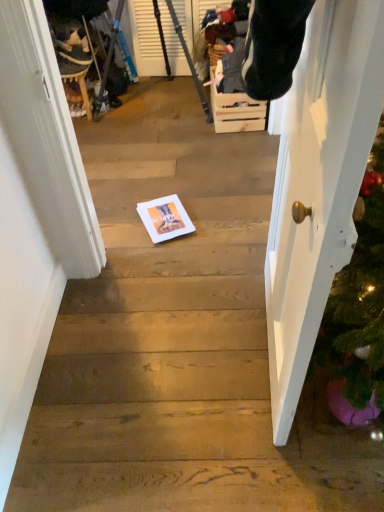
Find the location of a particular element. velvet plush toy at upper left is located at coordinates (72, 53).

This screenshot has width=384, height=512. What do you see at coordinates (189, 61) in the screenshot?
I see `metallic tripod at upper left` at bounding box center [189, 61].

What is the approximate height of white glossy door at right?

Result: white glossy door at right is 3.91 feet tall.

The height and width of the screenshot is (512, 384). What are the coordinates of `white paper at center` in the screenshot? It's located at (165, 218).

Choose the correct answer: Is velvet plush toy at upper left inside white glossy door at right or outside it?

velvet plush toy at upper left is located beyond the bounds of white glossy door at right.

Find the location of `door in front of the velvet plush toy at upper left`. door in front of the velvet plush toy at upper left is located at coordinates (319, 184).

Considering the sizes of velvet plush toy at upper left and white glossy door at right in the image, is velvet plush toy at upper left bigger or smaller than white glossy door at right?

velvet plush toy at upper left is smaller than white glossy door at right.

Does velvet plush toy at upper left have a lesser height compared to white glossy door at right?

Correct, velvet plush toy at upper left is not as tall as white glossy door at right.

Is wooden crate at center located outside metallic tripod at upper left?

Yes, wooden crate at center is located beyond the bounds of metallic tripod at upper left.

In order to click on drawer lying below the metallic tripod at upper left (from the image's perspective) in this screenshot , I will do `click(235, 110)`.

Is wooden crate at center not close to metallic tripod at upper left?

That's not correct — wooden crate at center is a little close to metallic tripod at upper left.

Is point (218, 106) closer to viewer compared to point (204, 104)?

Yes.

Considering the points (194, 230) and (107, 70), which point is in front, point (194, 230) or point (107, 70)?

The point (194, 230) is in front.

Find the location of a particular element. tripod located above the white paper at center (from a real-world perspective) is located at coordinates (189, 61).

Does white paper at center appear on the left side of metallic tripod at upper left?

In fact, white paper at center is to the right of metallic tripod at upper left.

Which is behind, point (176, 23) or point (150, 205)?

The point (176, 23) is behind.

From a real-world perspective, is metallic tripod at upper left under white paper at center?

No, from a real-world perspective, metallic tripod at upper left is not below white paper at center.

Considering the relative sizes of metallic tripod at upper left and white paper at center in the image provided, is metallic tripod at upper left shorter than white paper at center?

Incorrect, the height of metallic tripod at upper left does not fall short of that of white paper at center.

Is metallic tripod at upper left to the right of white paper at center from the viewer's perspective?

Incorrect, metallic tripod at upper left is not on the right side of white paper at center.

Based on the photo, from the image's perspective, is white paper at center under wooden crate at center?

Yes, from the image's perspective, white paper at center is below wooden crate at center.

Considering the positions of objects white paper at center and wooden crate at center in the image provided, who is more to the right, white paper at center or wooden crate at center?

From the viewer's perspective, wooden crate at center appears more on the right side.

Which object is thinner, white paper at center or wooden crate at center?

wooden crate at center is thinner.

Considering the positions of point (139, 207) and point (237, 110), is point (139, 207) closer or farther from the camera than point (237, 110)?

Point (139, 207) appears to be closer to the viewer than point (237, 110).

What's the angular difference between metallic tripod at upper left and wooden crate at center's facing directions?

85.5 degrees separate the facing orientations of metallic tripod at upper left and wooden crate at center.

Is point (115, 32) more distant than point (241, 124)?

Yes, point (115, 32) is farther from viewer.

Where is `tripod that is above the wooden crate at center (from a real-world perspective)`? tripod that is above the wooden crate at center (from a real-world perspective) is located at coordinates (189, 61).

Which of these two, metallic tripod at upper left or wooden crate at center, stands shorter?

With less height is wooden crate at center.

Is velvet plush toy at upper left shorter than wooden crate at center?

Yes.

How far apart are velvet plush toy at upper left and wooden crate at center?

The distance of velvet plush toy at upper left from wooden crate at center is 37.54 inches.

Can you tell me how much velvet plush toy at upper left and wooden crate at center differ in facing direction?

177 degrees separate the facing orientations of velvet plush toy at upper left and wooden crate at center.

Can you confirm if velvet plush toy at upper left is positioned to the right of wooden crate at center?

In fact, velvet plush toy at upper left is to the left of wooden crate at center.

At what (x,y) coordinates should I click in order to perform the action: click on door above the velvet plush toy at upper left (from a real-world perspective). Please return your answer as a coordinate pair (x, y). Looking at the image, I should click on (319, 184).

In order to click on drawer directly beneath the metallic tripod at upper left (from a real-world perspective) in this screenshot , I will do `click(235, 110)`.

Which object lies further to the anchor point white glossy door at right, velvet plush toy at upper left or wooden crate at center?

velvet plush toy at upper left.

When comparing their distances from white paper at center, does wooden crate at center or white glossy door at right seem closer?

Based on the image, white glossy door at right appears to be nearer to white paper at center.

Looking at the image, which one is located further to wooden crate at center, metallic tripod at upper left or velvet plush toy at upper left?

Based on the image, velvet plush toy at upper left appears to be further to wooden crate at center.

Looking at the image, which one is located further to wooden crate at center, metallic tripod at upper left or white glossy door at right?

white glossy door at right.

Estimate the real-world distances between objects in this image. Which object is closer to white paper at center, white glossy door at right or velvet plush toy at upper left?

Among the two, white glossy door at right is located nearer to white paper at center.

From the image, which object appears to be farther from velvet plush toy at upper left, white paper at center or metallic tripod at upper left?

Among the two, white paper at center is located further to velvet plush toy at upper left.

Estimate the real-world distances between objects in this image. Which object is closer to metallic tripod at upper left, velvet plush toy at upper left or white paper at center?

velvet plush toy at upper left.

Which object lies further to the anchor point metallic tripod at upper left, wooden crate at center or white glossy door at right?

white glossy door at right.

The width and height of the screenshot is (384, 512). Identify the location of copy between white glossy door at right and velvet plush toy at upper left along the z-axis. (165, 218).

The image size is (384, 512). I want to click on tripod between white glossy door at right and velvet plush toy at upper left in the front-back direction, so click(189, 61).

I want to click on drawer between velvet plush toy at upper left and white paper at center in the up-down direction, so click(235, 110).

At what (x,y) coordinates should I click in order to perform the action: click on tripod between velvet plush toy at upper left and wooden crate at center. Please return your answer as a coordinate pair (x, y). The image size is (384, 512). Looking at the image, I should click on (189, 61).